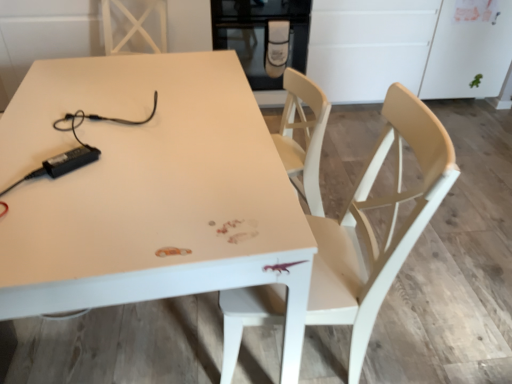
Identify the location of black glass oven at upper center. This screenshot has height=384, width=512. (261, 35).

The image size is (512, 384). What do you see at coordinates (149, 191) in the screenshot?
I see `white glossy table at center` at bounding box center [149, 191].

Find the location of a particular element. light wood chair at center is located at coordinates (372, 229).

Is light wood chair at center turned away from white glossy table at center?

That's not correct — light wood chair at center is not looking away from white glossy table at center.

How many degrees apart are the facing directions of light wood chair at center and white glossy table at center?

There is a 168-degree angle between the facing directions of light wood chair at center and white glossy table at center.

Which is more to the right, light wood chair at center or white glossy table at center?

From the viewer's perspective, light wood chair at center appears more on the right side.

Are light wood chair at center and white glossy table at center beside each other?

There is a gap between light wood chair at center and white glossy table at center.

Does white glossy table at center touch light wood chair at center?

No, white glossy table at center is not making contact with light wood chair at center.

How much distance is there between white glossy table at center and light wood chair at center?

white glossy table at center and light wood chair at center are 18.50 inches apart from each other.

Looking at their sizes, would you say white glossy table at center is wider or thinner than light wood chair at center?

Clearly, white glossy table at center has more width compared to light wood chair at center.

Is point (208, 53) farther from viewer compared to point (440, 191)?

Yes, point (208, 53) is farther from viewer.

How different are the orientations of light wood chair at center and black glass oven at upper center in degrees?

97.9 degrees.

Looking at their sizes, would you say light wood chair at center is wider or thinner than black glass oven at upper center?

Considering their sizes, light wood chair at center looks slimmer than black glass oven at upper center.

Which object is positioned more to the right, light wood chair at center or black glass oven at upper center?

From the viewer's perspective, light wood chair at center appears more on the right side.

Looking at this image, from the image's perspective, is light wood chair at center located above black glass oven at upper center?

Incorrect, from the image's perspective, light wood chair at center is lower than black glass oven at upper center.

What's the angular difference between black glass oven at upper center and light wood chair at center's facing directions?

The angular difference between black glass oven at upper center and light wood chair at center is 97.9 degrees.

Relative to light wood chair at center, is black glass oven at upper center in front or behind?

Clearly, black glass oven at upper center is behind light wood chair at center.

Are black glass oven at upper center and light wood chair at center located far from each other?

Absolutely, black glass oven at upper center is distant from light wood chair at center.

Can you confirm if black glass oven at upper center is smaller than light wood chair at center?

Indeed, black glass oven at upper center has a smaller size compared to light wood chair at center.

In the scene shown: Could you tell me if white glossy table at center is facing black glass oven at upper center?

No, white glossy table at center does not turn towards black glass oven at upper center.

From the image's perspective, is white glossy table at center located above or below black glass oven at upper center?

white glossy table at center is situated lower than black glass oven at upper center in the image.

Looking at this image, from a real-world perspective, is white glossy table at center physically located above or below black glass oven at upper center?

white glossy table at center is situated lower than black glass oven at upper center in the real world.

Considering their positions, is white glossy table at center located in front of or behind black glass oven at upper center?

white glossy table at center is in front of black glass oven at upper center.

Between black glass oven at upper center and white glossy table at center, which one has larger size?

white glossy table at center is bigger.

From a real-world perspective, is black glass oven at upper center beneath white glossy table at center?

No, from a real-world perspective, black glass oven at upper center is not below white glossy table at center.

Is white glossy table at center inside black glass oven at upper center?

That's incorrect, white glossy table at center is not inside black glass oven at upper center.

Find the location of `appliance above the white glossy table at center (from a real-world perspective)`. appliance above the white glossy table at center (from a real-world perspective) is located at coordinates (261, 35).

The width and height of the screenshot is (512, 384). I want to click on table on the left of the light wood chair at center, so click(149, 191).

Image resolution: width=512 pixels, height=384 pixels. In order to click on chair behind the white glossy table at center in this screenshot , I will do `click(372, 229)`.

Estimate the real-world distances between objects in this image. Which object is further from black glass oven at upper center, white glossy table at center or light wood chair at center?

The object further to black glass oven at upper center is light wood chair at center.

Which object lies further to the anchor point light wood chair at center, white glossy table at center or black glass oven at upper center?

black glass oven at upper center is positioned further to the anchor light wood chair at center.

When comparing their distances from light wood chair at center, does black glass oven at upper center or white glossy table at center seem closer?

white glossy table at center is closer to light wood chair at center.

Considering their positions, is light wood chair at center positioned closer to white glossy table at center than black glass oven at upper center?

Among the two, light wood chair at center is located nearer to white glossy table at center.

Considering their positions, is light wood chair at center positioned closer to black glass oven at upper center than white glossy table at center?

white glossy table at center.

Considering their positions, is black glass oven at upper center positioned further to white glossy table at center than light wood chair at center?

Among the two, black glass oven at upper center is located further to white glossy table at center.

Identify the location of chair between white glossy table at center and black glass oven at upper center from front to back. (372, 229).